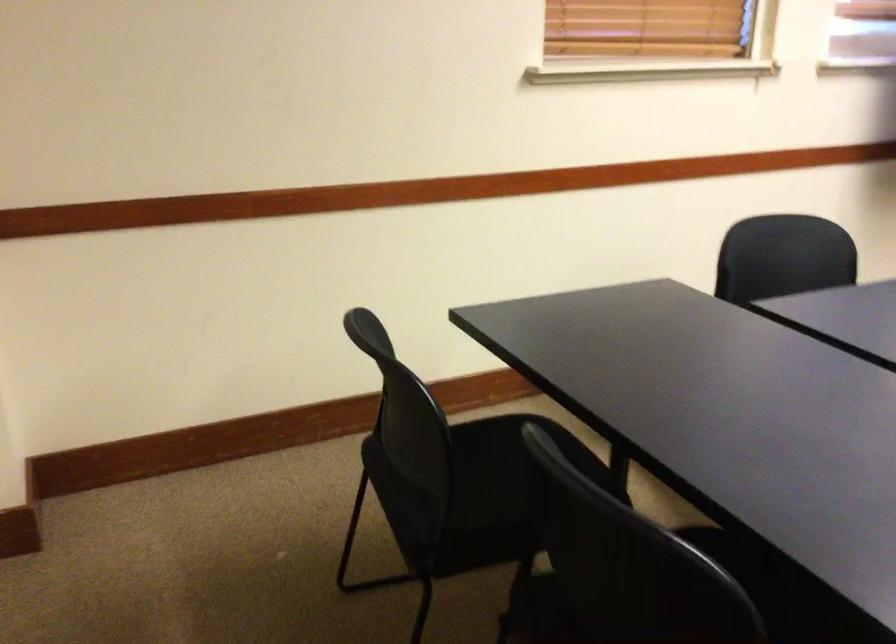
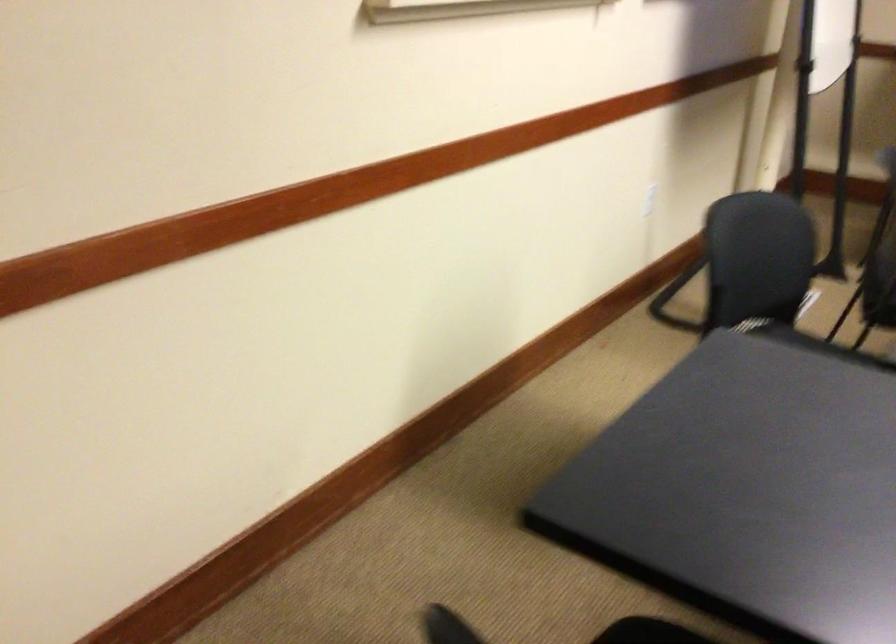
Question: Which direction would the cameraman need to move to produce the second image? Reply with the corresponding letter.

Choices:
 (A) Left
 (B) Right
 (C) Forward
 (D) Backward

Answer: (D)